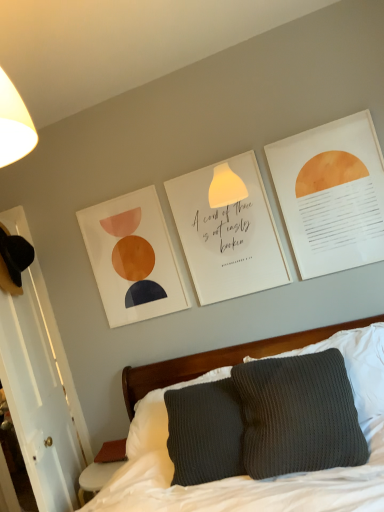
Question: From the image's perspective, is dark gray knitted pillow at center located above or below knitted gray pillow at center?

Choices:
 (A) above
 (B) below

Answer: (A)

Question: From a real-world perspective, is dark gray knitted pillow at center physically located above or below knitted gray pillow at center?

Choices:
 (A) above
 (B) below

Answer: (A)

Question: Which of these objects is positioned farthest from the matte paper picture frame at upper center?

Choices:
 (A) white paper at center, the 1th postcard positioned from the back
 (B) knitted gray pillow at center
 (C) matte orange circle at upper right, acting as the 2th postcard starting from the left
 (D) dark gray knitted pillow at center

Answer: (D)

Question: Which of these objects is positioned farthest from the knitted gray pillow at center?

Choices:
 (A) dark gray knitted pillow at center
 (B) matte orange circle at upper right, the first postcard viewed from the front
 (C) white paper at center, the 1th postcard positioned from the back
 (D) matte paper picture frame at upper center

Answer: (B)